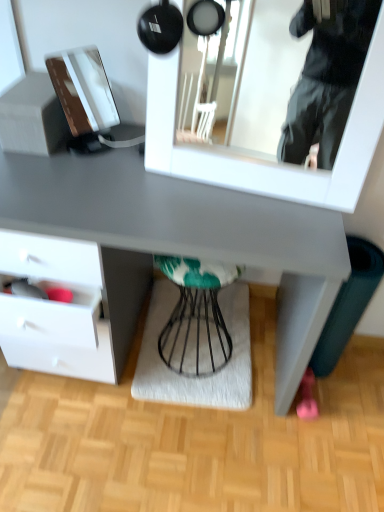
Where is `vacant area situated to the left side of white glossy mirror at upper center`? The height and width of the screenshot is (512, 384). vacant area situated to the left side of white glossy mirror at upper center is located at coordinates (119, 183).